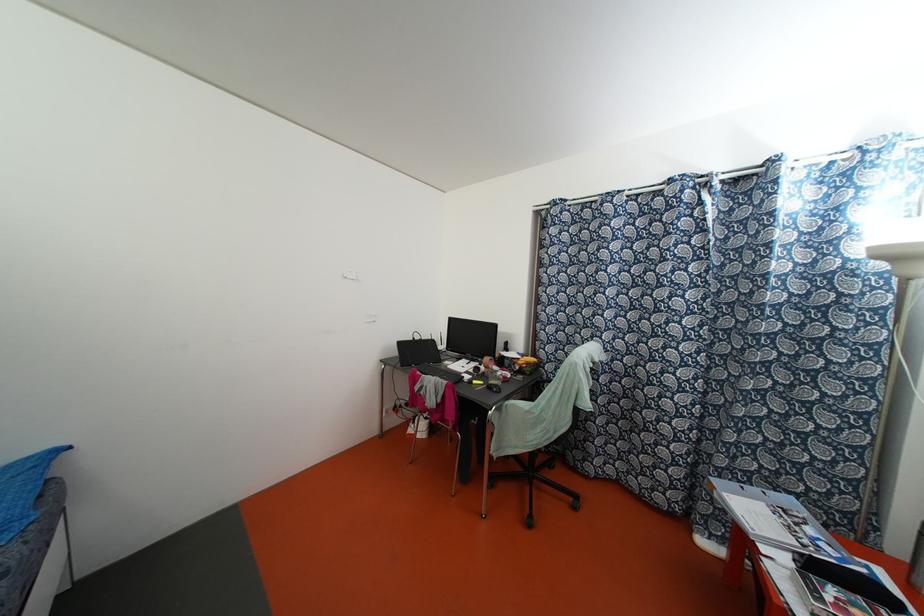
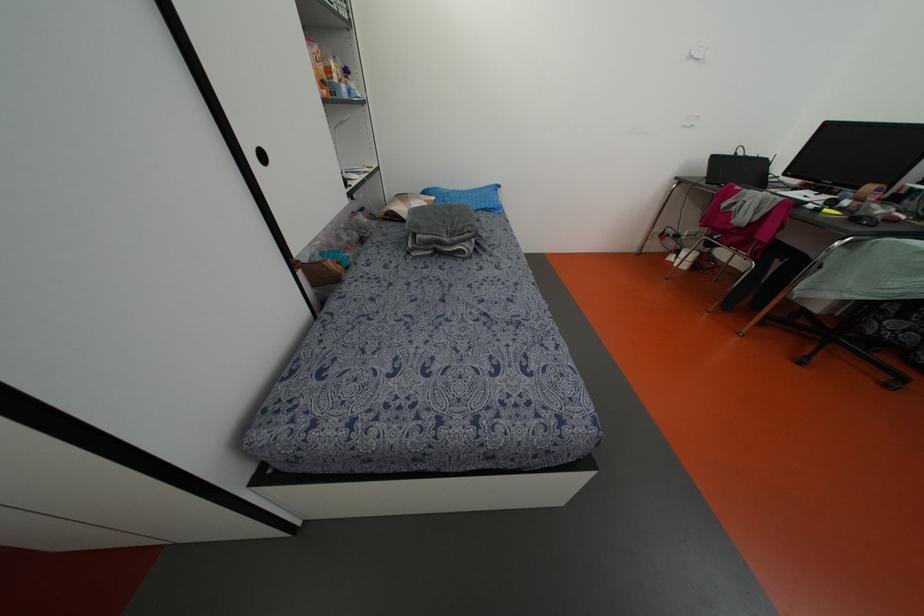
In the second image, find the point that corresponds to [416,338] in the first image.

(739, 153)